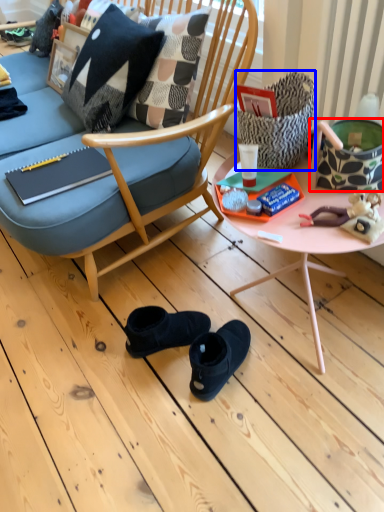
Question: Which object appears closest to the camera in this image, handbag (highlighted by a red box) or handbag (highlighted by a blue box)?

Choices:
 (A) handbag
 (B) handbag

Answer: (A)